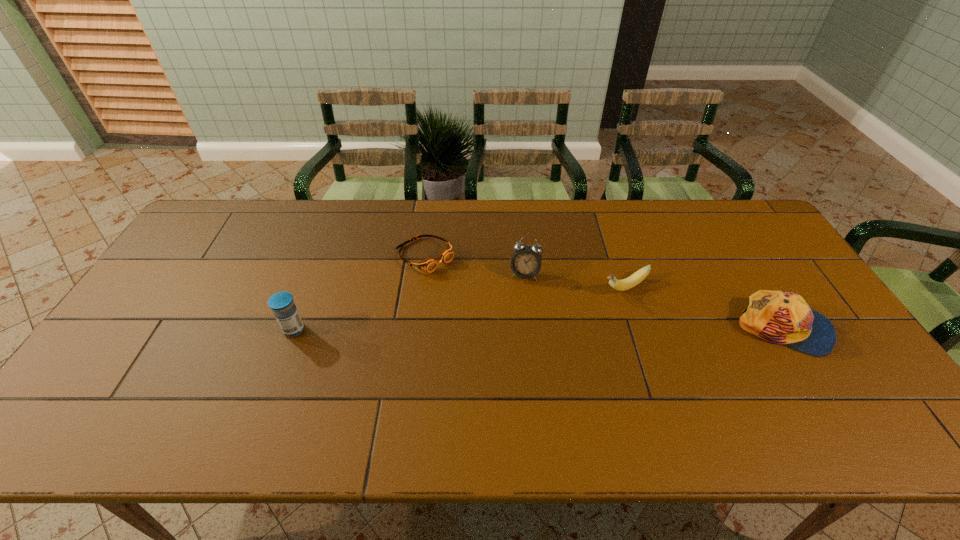
Identify the location of vacant space located 0.200m on the face of the alarm clock. (513, 335).

The width and height of the screenshot is (960, 540). Find the location of `blank space located 0.190m on the face of the alarm clock`. blank space located 0.190m on the face of the alarm clock is located at coordinates (513, 333).

Find the location of a particular element. The image size is (960, 540). vacant space located on the face of the alarm clock is located at coordinates [504, 377].

The height and width of the screenshot is (540, 960). What are the coordinates of `free space located 0.300m with the lenses facing forward on the shortest object` in the screenshot? It's located at (512, 330).

This screenshot has height=540, width=960. I want to click on vacant space located with the lenses facing forward on the shortest object, so click(x=487, y=308).

Where is `vacant space located 0.170m with the lenses facing forward on the shortest object`? vacant space located 0.170m with the lenses facing forward on the shortest object is located at coordinates point(480,302).

At what (x,y) coordinates should I click in order to perform the action: click on object that is at the far edge. Please return your answer as a coordinate pair (x, y). Image resolution: width=960 pixels, height=540 pixels. Looking at the image, I should click on (428, 265).

This screenshot has height=540, width=960. Find the location of `object that is at the right edge`. object that is at the right edge is located at coordinates (778, 317).

Where is `free space at the far edge`? The height and width of the screenshot is (540, 960). free space at the far edge is located at coordinates click(301, 231).

In the image, there is a desktop. Find the location of `vacant space at the near edge`. vacant space at the near edge is located at coordinates (609, 393).